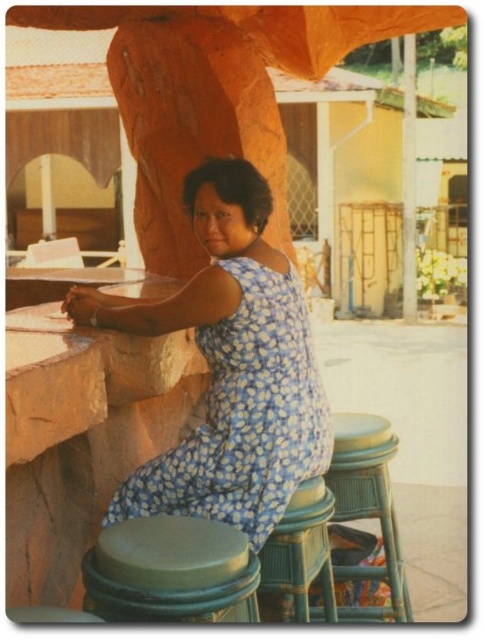
Question: Considering the real-world distances, which object is farthest from the green plastic bar stool at lower center?

Choices:
 (A) blue floral fabric dress at center
 (B) teal wood bar stool at lower center
 (C) smooth stone pillar at center

Answer: (C)

Question: Which object is positioned farthest from the smooth stone pillar at center?

Choices:
 (A) green plastic bar stool at lower center
 (B) blue floral fabric dress at center
 (C) green rubber bar stool at lower center
 (D) teal wood bar stool at lower center

Answer: (C)

Question: From the image, what is the correct spatial relationship of green rubber bar stool at lower center in relation to teal wood bar stool at lower center?

Choices:
 (A) left
 (B) right

Answer: (A)

Question: Observing the image, what is the correct spatial positioning of blue floral fabric dress at center in reference to teal wood bar stool at lower center?

Choices:
 (A) above
 (B) below

Answer: (A)

Question: Can you confirm if teal wood bar stool at lower center is positioned to the right of green plastic bar stool at lower center?

Choices:
 (A) yes
 (B) no

Answer: (A)

Question: Which point is closer to the camera?

Choices:
 (A) teal wood bar stool at lower center
 (B) smooth stone pillar at center
 (C) blue floral fabric dress at center
 (D) green rubber bar stool at lower center

Answer: (D)